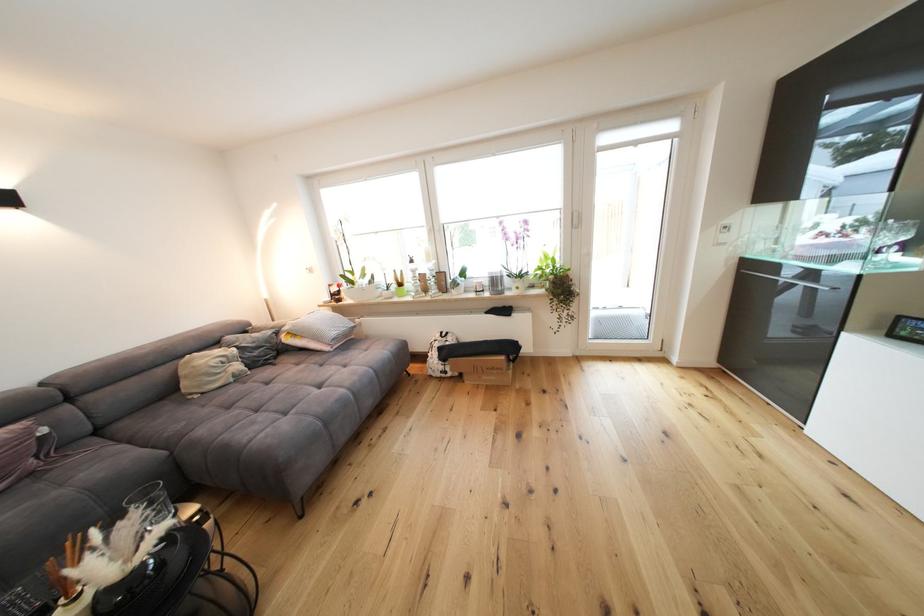
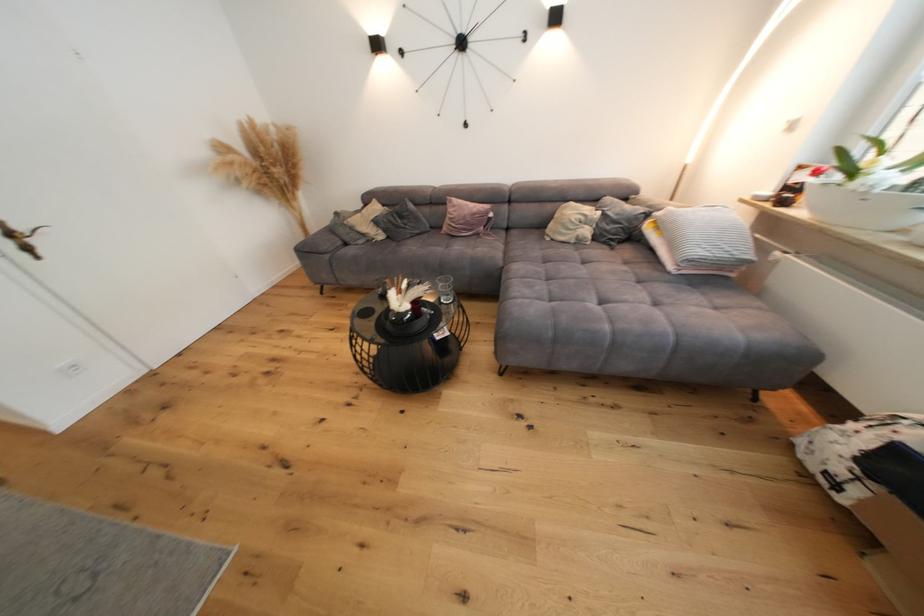
In the second image, find the point that corresponds to (x=342, y=291) in the first image.

(809, 179)